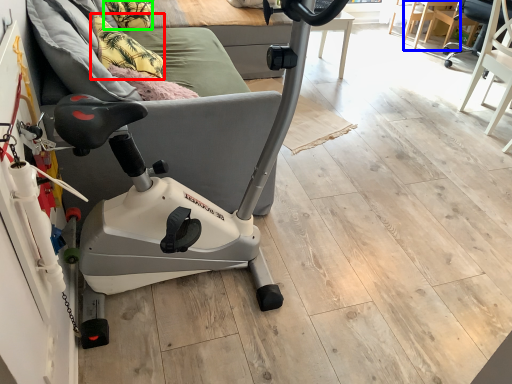
Question: Which object is the closest to the pillow (highlighted by a red box)? Choose among these: table (highlighted by a blue box) or pillow (highlighted by a green box).

Choices:
 (A) table
 (B) pillow

Answer: (B)